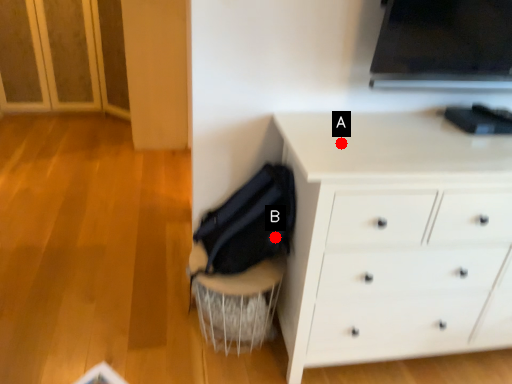
Question: Two points are circled on the image, labeled by A and B beside each circle. Which point appears closest to the camera in this image?

Choices:
 (A) A is closer
 (B) B is closer

Answer: (A)